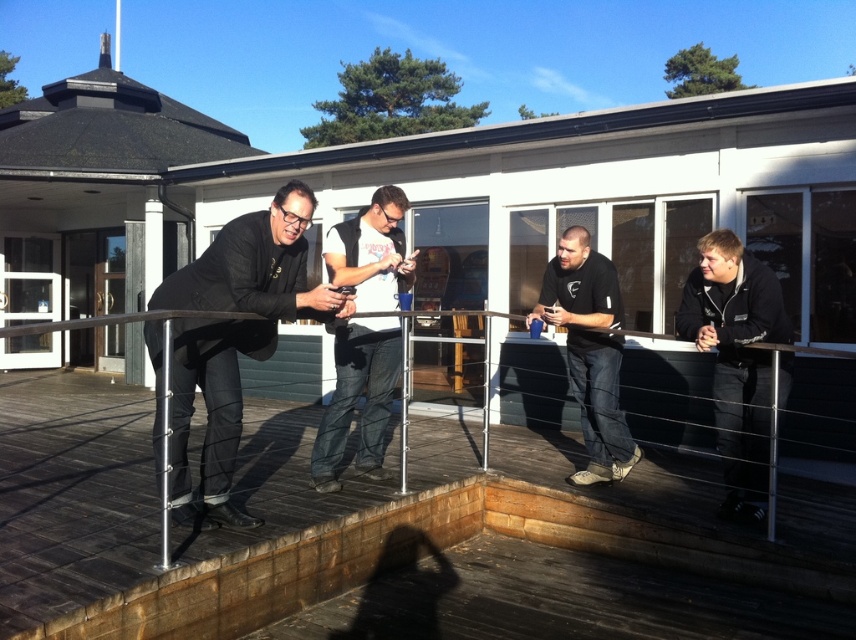
Question: Does black matte jacket at left appear over black matte shirt at center?

Choices:
 (A) no
 (B) yes

Answer: (B)

Question: Which object appears closest to the camera in this image?

Choices:
 (A) black matte jacket at left
 (B) wooden deck at center
 (C) black fleece jacket at right

Answer: (A)

Question: Can you confirm if black fleece jacket at right is positioned to the left of white cotton t-shirt at center?

Choices:
 (A) no
 (B) yes

Answer: (A)

Question: Which object is the closest to the black matte jacket at left?

Choices:
 (A) wooden deck at center
 (B) black fleece jacket at right
 (C) black matte shirt at center
 (D) white cotton t-shirt at center

Answer: (D)

Question: Considering the relative positions of white cotton t-shirt at center and black matte shirt at center in the image provided, where is white cotton t-shirt at center located with respect to black matte shirt at center?

Choices:
 (A) right
 (B) left

Answer: (B)

Question: Among these objects, which one is farthest from the camera?

Choices:
 (A) white cotton t-shirt at center
 (B) black fleece jacket at right
 (C) black matte jacket at left

Answer: (B)